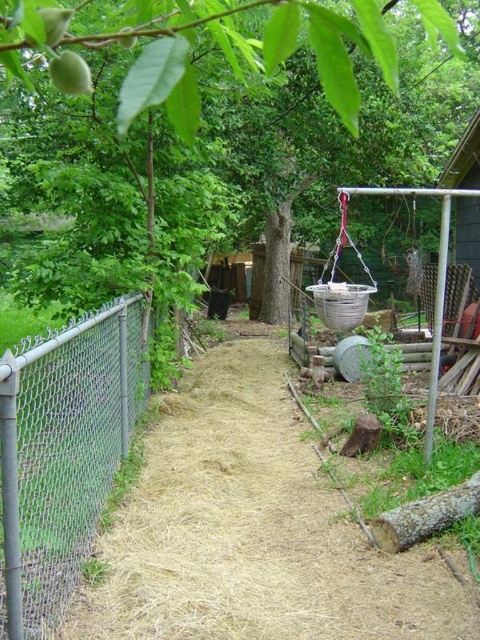
Question: Which point appears farthest from the camera in this image?

Choices:
 (A) (460, 228)
 (B) (193, 6)
 (C) (32, 42)

Answer: (A)

Question: From the image, what is the correct spatial relationship of green leafy tree at upper center in relation to green matte apple at upper left?

Choices:
 (A) below
 (B) above

Answer: (A)

Question: Observing the image, what is the correct spatial positioning of metallic wire hut at upper right in reference to green matte peach at upper left?

Choices:
 (A) right
 (B) left

Answer: (A)

Question: Does green leafy tree at upper center have a lesser width compared to green matte apple at upper left?

Choices:
 (A) no
 (B) yes

Answer: (A)

Question: Which point is farther to the camera?

Choices:
 (A) green matte peach at upper left
 (B) green matte fruit at upper left

Answer: (B)

Question: Which point is closer to the camera taking this photo?

Choices:
 (A) (127, 28)
 (B) (476, 125)
 (C) (297, 10)
 (D) (73, 60)

Answer: (C)